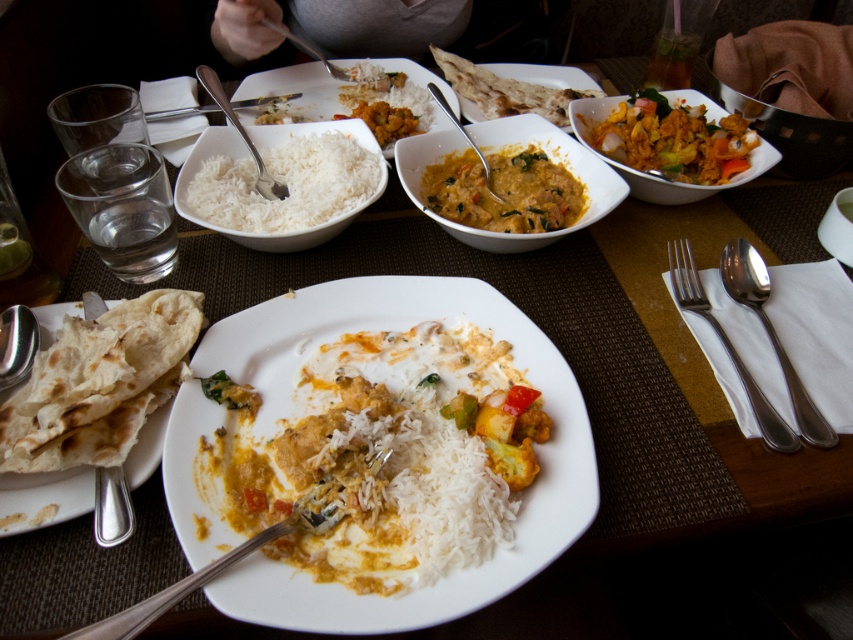
Who is taller, rich yellow curry with vegetables at upper right or white matte rice at center?

With more height is white matte rice at center.

Can you confirm if rich yellow curry with vegetables at upper right is positioned above white matte rice at center?

No.

Is point (631, 164) positioned before point (451, 104)?

Yes, it is in front of point (451, 104).

This screenshot has height=640, width=853. Find the location of `rich yellow curry with vegetables at upper right`. rich yellow curry with vegetables at upper right is located at coordinates (670, 140).

Which is in front, point (396, 99) or point (103, 513)?

Point (103, 513) is in front.

Describe the element at coordinates (293, 90) in the screenshot. I see `white matte rice at center` at that location.

What do you see at coordinates (293, 90) in the screenshot? The width and height of the screenshot is (853, 640). I see `white matte rice at center` at bounding box center [293, 90].

This screenshot has height=640, width=853. I want to click on white matte rice at center, so click(293, 90).

Is silvermetallicspoon at right positioned behind satin silver fork at upper center?

No, it is in front of satin silver fork at upper center.

Who is more forward, (795, 397) or (247, 141)?

Point (795, 397)

Which is in front, point (822, 440) or point (257, 189)?

Point (822, 440)

This screenshot has height=640, width=853. What are the coordinates of `silvermetallicspoon at right` in the screenshot? It's located at (770, 332).